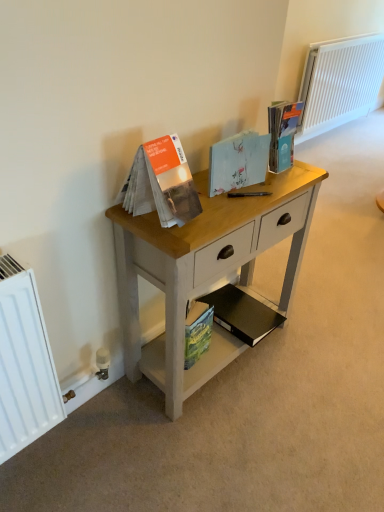
Question: Should I look upward or downward to see light wood desk at center?

Choices:
 (A) up
 (B) down

Answer: (B)

Question: From the image's perspective, does matte blue paperback book at upper right, the 1th paperback book viewed from the top, appear lower than white painted radiator at upper right?

Choices:
 (A) no
 (B) yes

Answer: (B)

Question: Is matte blue paperback book at upper right, the 1th paperback book viewed from the top, further to the viewer compared to white painted radiator at upper right?

Choices:
 (A) yes
 (B) no

Answer: (B)

Question: Is matte blue paperback book at upper right, the 4th paperback book when ordered from bottom to top, closer to camera compared to white painted radiator at upper right?

Choices:
 (A) no
 (B) yes

Answer: (B)

Question: Considering the relative positions of matte blue paperback book at upper right, the 4th paperback book when ordered from bottom to top, and white painted radiator at upper right in the image provided, is matte blue paperback book at upper right, the 4th paperback book when ordered from bottom to top, to the left of white painted radiator at upper right from the viewer's perspective?

Choices:
 (A) yes
 (B) no

Answer: (A)

Question: From the image's perspective, is matte blue paperback book at upper right, the 4th paperback book when ordered from bottom to top, on white painted radiator at upper right?

Choices:
 (A) no
 (B) yes

Answer: (A)

Question: Does matte blue paperback book at upper right, the 1th paperback book viewed from the top, have a lesser width compared to white painted radiator at upper right?

Choices:
 (A) no
 (B) yes

Answer: (B)

Question: Can you confirm if light blue paper at center, the 2th paperback book positioned from the top, is wider than black matte book at lower center, which is the 2th paperback book from bottom to top?

Choices:
 (A) yes
 (B) no

Answer: (B)

Question: From the image's perspective, is light blue paper at center, the 2th paperback book positioned from the top, located above black matte book at lower center, marked as the 3th paperback book in a top-to-bottom arrangement?

Choices:
 (A) yes
 (B) no

Answer: (A)

Question: Is black matte book at lower center, marked as the 3th paperback book in a top-to-bottom arrangement, at the back of light blue paper at center, the 2th paperback book positioned from the top?

Choices:
 (A) no
 (B) yes

Answer: (A)

Question: Can you confirm if light blue paper at center, the 2th paperback book positioned from the top, is bigger than black matte book at lower center, marked as the 3th paperback book in a top-to-bottom arrangement?

Choices:
 (A) yes
 (B) no

Answer: (B)

Question: From the image's perspective, is light blue paper at center, the third paperback book positioned from the bottom, below black matte book at lower center, which is the 2th paperback book from bottom to top?

Choices:
 (A) no
 (B) yes

Answer: (A)

Question: From a real-world perspective, is light blue paper at center, the 2th paperback book positioned from the top, under black matte book at lower center, marked as the 3th paperback book in a top-to-bottom arrangement?

Choices:
 (A) no
 (B) yes

Answer: (A)

Question: From a real-world perspective, is light wood desk at center on white painted radiator at upper right?

Choices:
 (A) no
 (B) yes

Answer: (A)